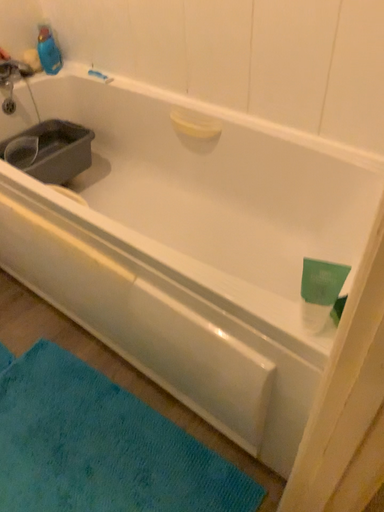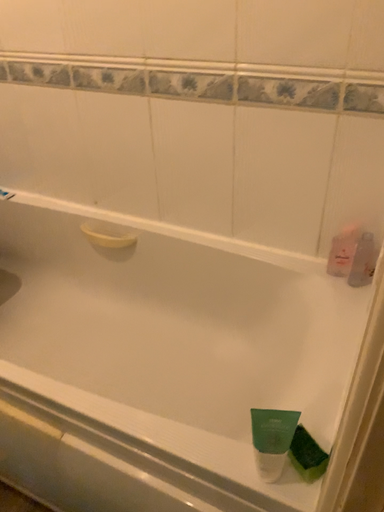
Question: How did the camera likely rotate when shooting the video?

Choices:
 (A) rotated right
 (B) rotated left

Answer: (A)